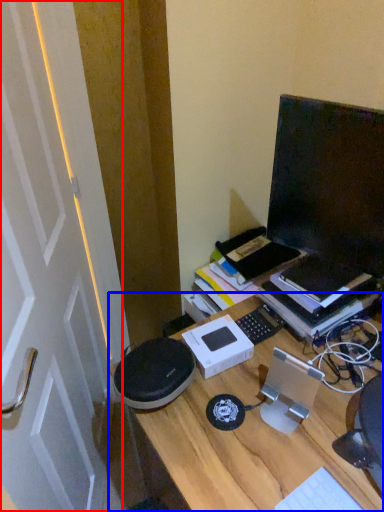
Question: Which object appears farthest to the camera in this image, door (highlighted by a red box) or desk (highlighted by a blue box)?

Choices:
 (A) door
 (B) desk

Answer: (B)